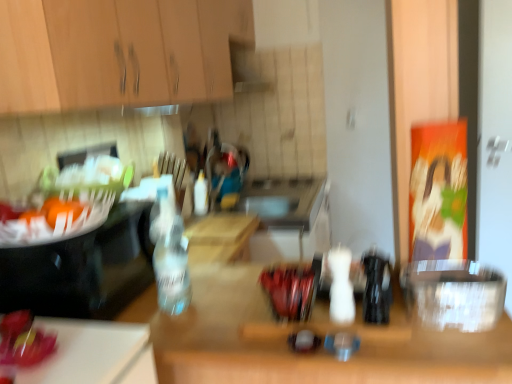
Question: From a real-world perspective, is transparent plastic container at right, which is the first appliance from right to left, on top of shiny red apple at lower left?

Choices:
 (A) no
 (B) yes

Answer: (A)

Question: Does transparent plastic container at right, the second appliance positioned from the left, have a larger size compared to shiny red apple at lower left?

Choices:
 (A) no
 (B) yes

Answer: (B)

Question: Would you say transparent plastic container at right, the second appliance positioned from the left, contains shiny red apple at lower left?

Choices:
 (A) yes
 (B) no

Answer: (B)

Question: Can you confirm if transparent plastic container at right, which is the first appliance from right to left, is taller than shiny red apple at lower left?

Choices:
 (A) yes
 (B) no

Answer: (A)

Question: Is transparent plastic container at right, which is the first appliance from right to left, to the left of shiny red apple at lower left from the viewer's perspective?

Choices:
 (A) no
 (B) yes

Answer: (A)

Question: Is transparent plastic container at right, the second appliance positioned from the left, smaller than shiny red apple at lower left?

Choices:
 (A) no
 (B) yes

Answer: (A)

Question: Is wooden cabinet at upper left wider than white plastic bottle at center, which is counted as the 1th bottle, starting from the back?

Choices:
 (A) no
 (B) yes

Answer: (B)

Question: Could you tell me if wooden cabinet at upper left is turned towards white plastic bottle at center, the 3th bottle from the front?

Choices:
 (A) no
 (B) yes

Answer: (A)

Question: Is wooden cabinet at upper left to the right of white plastic bottle at center, the 3th bottle from the front, from the viewer's perspective?

Choices:
 (A) no
 (B) yes

Answer: (A)

Question: Considering the relative sizes of wooden cabinet at upper left and white plastic bottle at center, which is counted as the 1th bottle, starting from the back, in the image provided, is wooden cabinet at upper left shorter than white plastic bottle at center, which is counted as the 1th bottle, starting from the back,?

Choices:
 (A) yes
 (B) no

Answer: (B)

Question: Is wooden cabinet at upper left in front of white plastic bottle at center, which is counted as the 1th bottle, starting from the back?

Choices:
 (A) no
 (B) yes

Answer: (B)

Question: Is wooden cabinet at upper left turned away from white plastic bottle at center, arranged as the third bottle when viewed from the right?

Choices:
 (A) yes
 (B) no

Answer: (B)

Question: Does black plastic bottle at center, the 3th bottle when ordered from left to right, have a lesser height compared to transparent plastic container at right, the second appliance positioned from the left?

Choices:
 (A) yes
 (B) no

Answer: (B)